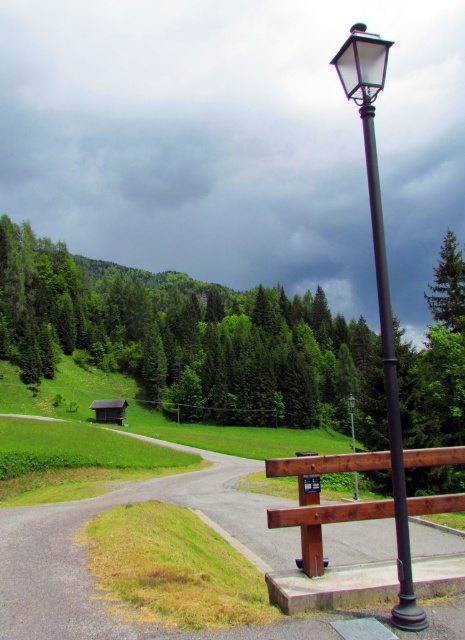
You are a hiker trying to decide whether to take the left path or the right path at the fork. You notice the green matte tree at upper center and the brown wooden hut at lower left. Which object is bigger and might help you choose your path?

The green matte tree at upper center is larger in size than the brown wooden hut at lower left, so it might be a more prominent landmark to guide your decision.

You are standing at the fork in the road and see the asphalt road at center and the brown wooden bench at center. Which object is higher?

The asphalt road at center is higher than the brown wooden bench at center.